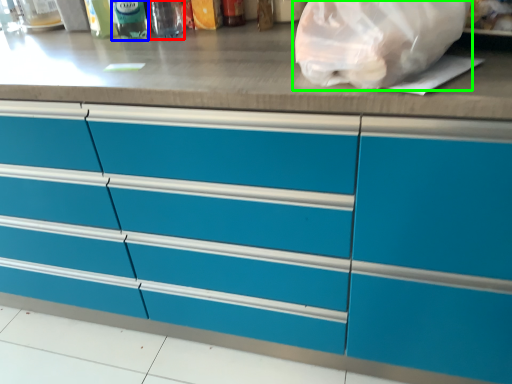
Question: Estimate the real-world distances between objects in this image. Which object is farther from bottle (highlighted by a red box), bottle (highlighted by a blue box) or plastic bag (highlighted by a green box)?

Choices:
 (A) bottle
 (B) plastic bag

Answer: (B)